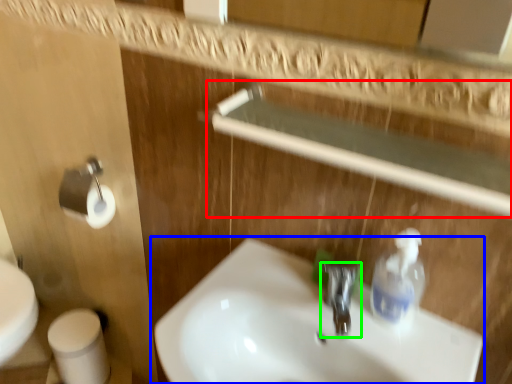
Question: Which object is positioned farthest from balustrade (highlighted by a red box)? Select from sink (highlighted by a blue box) and tap (highlighted by a green box).

Choices:
 (A) sink
 (B) tap

Answer: (A)